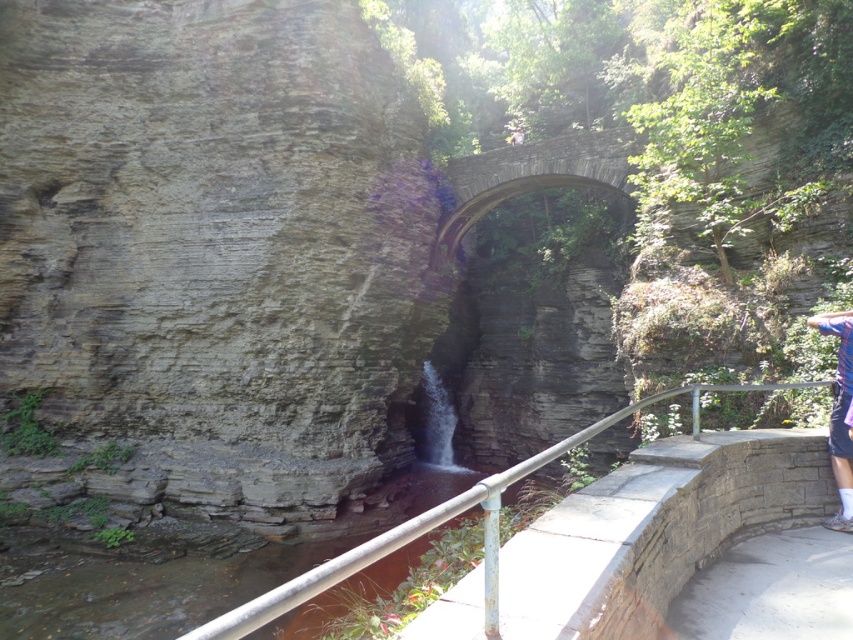
Question: Is metallic gray rail at lower center above blue striped shirt at right?

Choices:
 (A) no
 (B) yes

Answer: (A)

Question: Considering the real-world distances, which object is closest to the stone arch bridge at center?

Choices:
 (A) blue striped shirt at right
 (B) metallic gray rail at lower center

Answer: (B)

Question: Among these points, which one is nearest to the camera?

Choices:
 (A) (839, 385)
 (B) (373, 547)

Answer: (B)

Question: Which point is closer to the camera?

Choices:
 (A) stone arch bridge at center
 (B) blue striped shirt at right
 (C) metallic gray rail at lower center

Answer: (C)

Question: Is stone arch bridge at center above blue striped shirt at right?

Choices:
 (A) yes
 (B) no

Answer: (A)

Question: Does stone arch bridge at center appear on the right side of metallic gray rail at lower center?

Choices:
 (A) no
 (B) yes

Answer: (B)